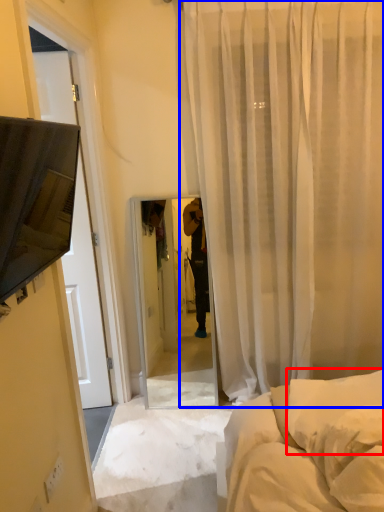
Question: Which point is closer to the camera, pillow (highlighted by a red box) or curtain (highlighted by a blue box)?

Choices:
 (A) pillow
 (B) curtain

Answer: (A)